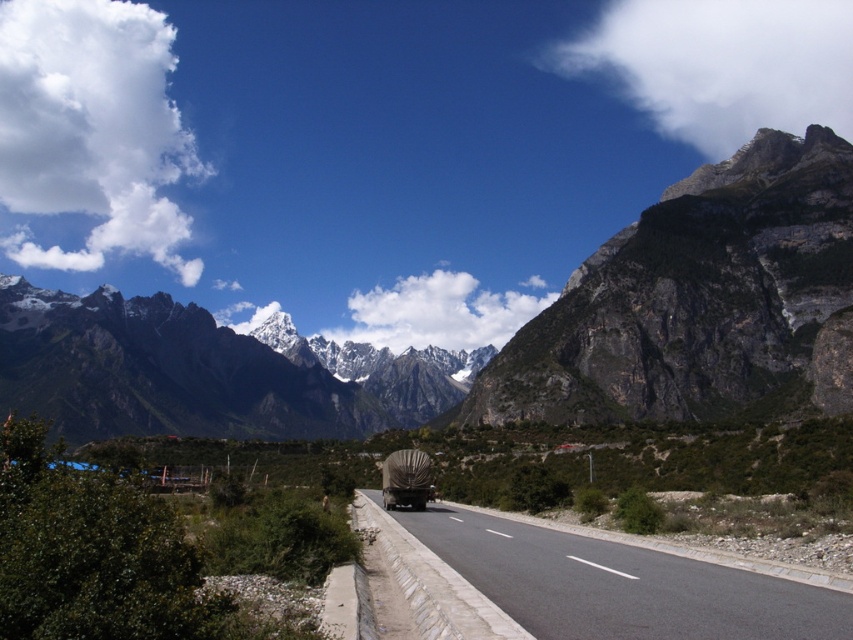
Question: Does dark gray rocky mountain at upper right appear under black asphalt road at center?

Choices:
 (A) no
 (B) yes

Answer: (A)

Question: Among these objects, which one is farthest from the camera?

Choices:
 (A) dark gray rocky mountain at upper right
 (B) dark gray rocky mountain range at upper center
 (C) black asphalt road at center

Answer: (B)

Question: Is dark gray rocky mountain range at upper center smaller than gray concrete road at center?

Choices:
 (A) yes
 (B) no

Answer: (B)

Question: Is dark gray rocky mountain at upper right bigger than gray concrete road at center?

Choices:
 (A) yes
 (B) no

Answer: (A)

Question: Which point appears farthest from the camera in this image?

Choices:
 (A) (7, 358)
 (B) (460, 579)

Answer: (A)

Question: Which of the following is the farthest from the observer?

Choices:
 (A) coord(833,298)
 (B) coord(523,568)

Answer: (A)